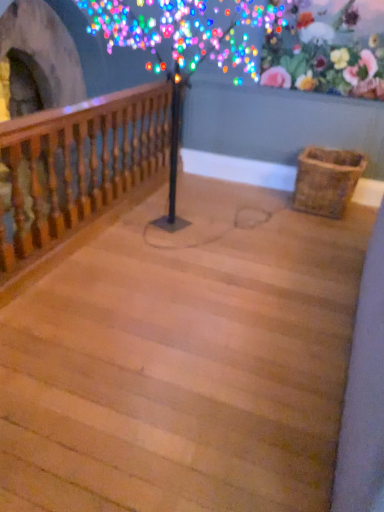
Question: Is floral fabric at upper right not close to wooden baluster at left?

Choices:
 (A) no
 (B) yes

Answer: (B)

Question: Does floral fabric at upper right appear on the right side of wooden baluster at left?

Choices:
 (A) no
 (B) yes

Answer: (B)

Question: Does floral fabric at upper right have a lesser width compared to wooden baluster at left?

Choices:
 (A) yes
 (B) no

Answer: (A)

Question: Considering the relative positions of floral fabric at upper right and wooden baluster at left in the image provided, is floral fabric at upper right in front of wooden baluster at left?

Choices:
 (A) no
 (B) yes

Answer: (A)

Question: Could wooden baluster at left be considered to be inside floral fabric at upper right?

Choices:
 (A) no
 (B) yes

Answer: (A)

Question: Does floral fabric at upper right have a lesser height compared to wooden baluster at left?

Choices:
 (A) yes
 (B) no

Answer: (A)

Question: Can you confirm if woven brown basket at lower right is smaller than wooden baluster at left?

Choices:
 (A) yes
 (B) no

Answer: (A)

Question: Does woven brown basket at lower right have a greater height compared to wooden baluster at left?

Choices:
 (A) yes
 (B) no

Answer: (B)

Question: Considering the relative sizes of woven brown basket at lower right and wooden baluster at left in the image provided, is woven brown basket at lower right shorter than wooden baluster at left?

Choices:
 (A) yes
 (B) no

Answer: (A)

Question: Is the position of woven brown basket at lower right more distant than that of wooden baluster at left?

Choices:
 (A) yes
 (B) no

Answer: (A)

Question: From a real-world perspective, is woven brown basket at lower right located higher than wooden baluster at left?

Choices:
 (A) no
 (B) yes

Answer: (A)

Question: From the image's perspective, does woven brown basket at lower right appear lower than wooden baluster at left?

Choices:
 (A) yes
 (B) no

Answer: (A)

Question: Is floral fabric at upper right at the right side of wooden stairs at center?

Choices:
 (A) no
 (B) yes

Answer: (B)